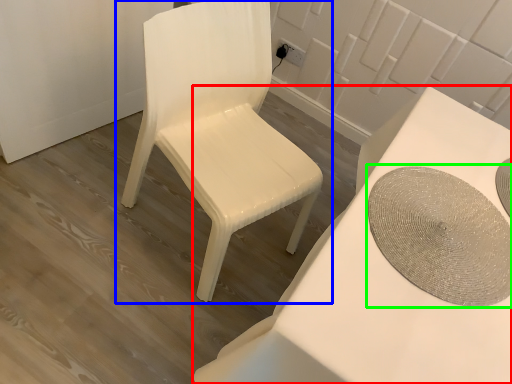
Question: Which is nearer to the table (highlighted by a red box)? chair (highlighted by a blue box) or round table (highlighted by a green box).

Choices:
 (A) chair
 (B) round table

Answer: (B)